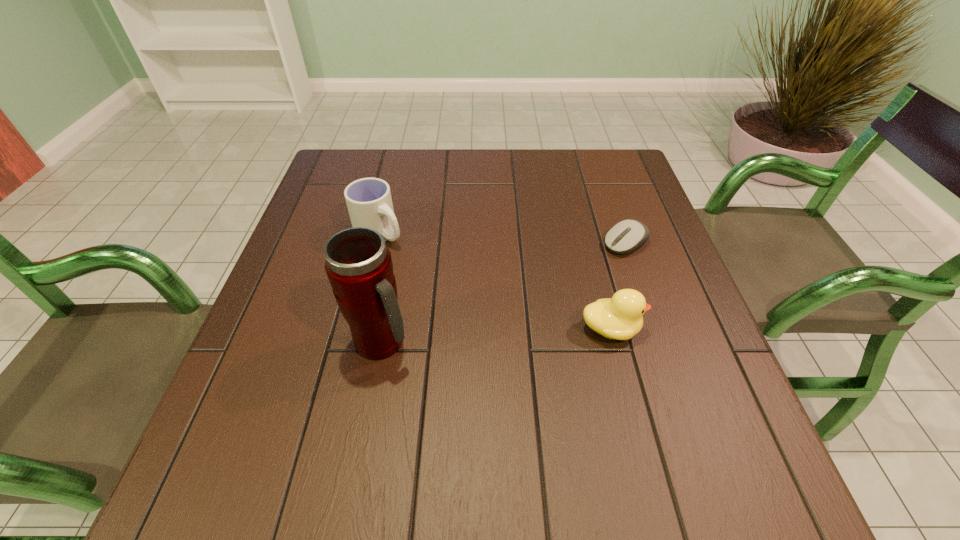
The height and width of the screenshot is (540, 960). Find the location of `free spot that satisfies the following two spatial constraints: 1. on the front side of the third tallest object; 2. on the beak of the cup`. free spot that satisfies the following two spatial constraints: 1. on the front side of the third tallest object; 2. on the beak of the cup is located at coordinates (357, 329).